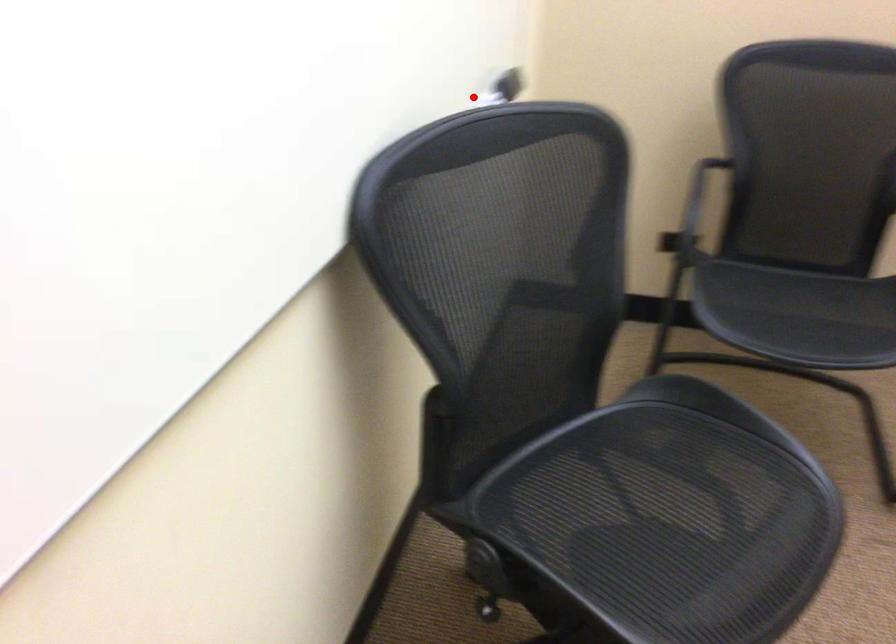
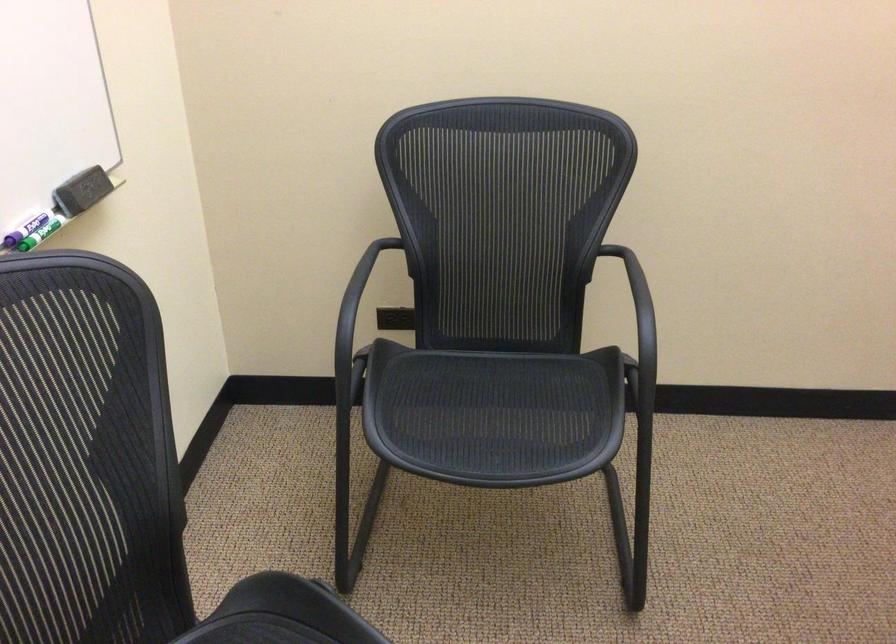
Locate, in the second image, the point that corresponds to the highlighted location in the first image.

(26, 228)